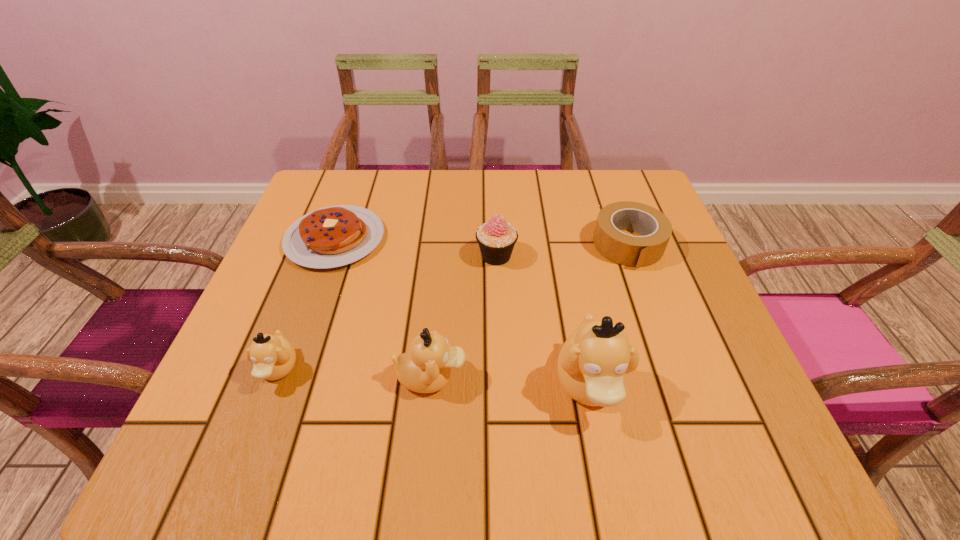
You are a GUI agent. You are given a task and a screenshot of the screen. Output one action in this format:
    pyautogui.click(x=<x>, y=<y>)
    Task: Click on the free space that satisfies the following two spatial constraints: 1. at the edge of the duct tape; 2. on the face of the second duckling from left to right
    
    Given the screenshot: What is the action you would take?
    pyautogui.click(x=677, y=377)